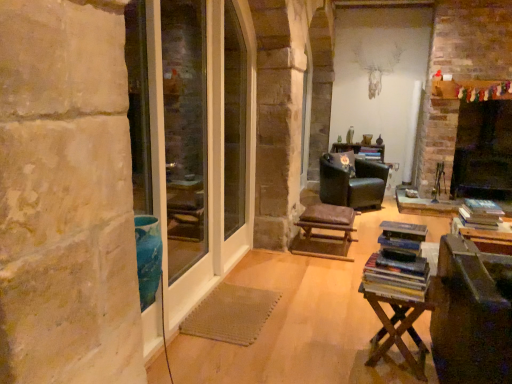
You are a GUI agent. You are given a task and a screenshot of the screen. Output one action in this format:
    pyautogui.click(x=<x>, y=<y>)
    Task: Click on the vacant area that lies between brown leather stool at center and clear glass screen door at left, which is the 2th screen door in left-to-right order
    The image size is (512, 384).
    Given the screenshot: What is the action you would take?
    pyautogui.click(x=264, y=288)